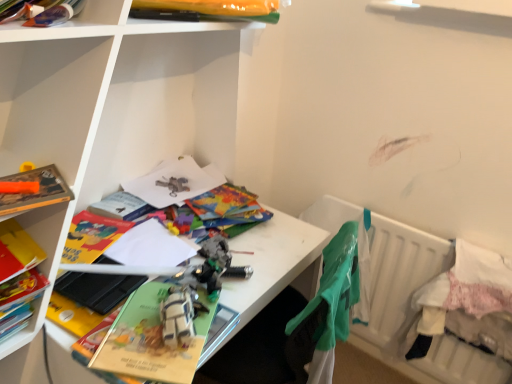
Question: From a real-world perspective, is white matte desk at center, which is the second shelf in back-to-front order, under hardcover book at left, arranged as the first book when viewed from the left?

Choices:
 (A) yes
 (B) no

Answer: (A)

Question: Does white matte desk at center, which is the 2th shelf in left-to-right order, have a greater height compared to hardcover book at left, arranged as the first book when viewed from the left?

Choices:
 (A) no
 (B) yes

Answer: (B)

Question: From the image's perspective, is white matte desk at center, acting as the first shelf starting from the front, located above hardcover book at left, arranged as the first book when viewed from the left?

Choices:
 (A) yes
 (B) no

Answer: (A)

Question: Can you confirm if white matte desk at center, acting as the first shelf starting from the front, is thinner than hardcover book at left, arranged as the first book when viewed from the left?

Choices:
 (A) no
 (B) yes

Answer: (A)

Question: Is white matte desk at center, arranged as the first shelf when ordered from the bottom, located outside hardcover book at left, arranged as the first book when viewed from the left?

Choices:
 (A) no
 (B) yes

Answer: (B)

Question: Is white matte desk at center, which is the second shelf in back-to-front order, turned away from hardcover book at left, arranged as the second book when viewed from the right?

Choices:
 (A) yes
 (B) no

Answer: (A)

Question: Does matte plastic books at upper left, the first shelf viewed from the top, contain hardcover book at left, arranged as the second book when viewed from the right?

Choices:
 (A) no
 (B) yes

Answer: (A)

Question: Considering the relative positions of matte plastic books at upper left, which is the first shelf from left to right, and hardcover book at left, arranged as the first book when viewed from the left, in the image provided, is matte plastic books at upper left, which is the first shelf from left to right, to the left of hardcover book at left, arranged as the first book when viewed from the left, from the viewer's perspective?

Choices:
 (A) no
 (B) yes

Answer: (A)

Question: From the image's perspective, is matte plastic books at upper left, acting as the second shelf starting from the front, below hardcover book at left, arranged as the first book when viewed from the left?

Choices:
 (A) yes
 (B) no

Answer: (B)

Question: Does matte plastic books at upper left, acting as the second shelf starting from the front, have a greater width compared to hardcover book at left, arranged as the second book when viewed from the right?

Choices:
 (A) no
 (B) yes

Answer: (A)

Question: Can you confirm if matte plastic books at upper left, which is the 2th shelf in bottom-to-top order, is smaller than hardcover book at left, which ranks as the 1th book in bottom-to-top order?

Choices:
 (A) yes
 (B) no

Answer: (A)

Question: Is matte plastic books at upper left, the first shelf viewed from the top, to the right of hardcover book at left, arranged as the first book when viewed from the left, from the viewer's perspective?

Choices:
 (A) no
 (B) yes

Answer: (B)

Question: Could you tell me if green fabric at right is turned towards hardcover book at left, which ranks as the 1th book in bottom-to-top order?

Choices:
 (A) yes
 (B) no

Answer: (B)